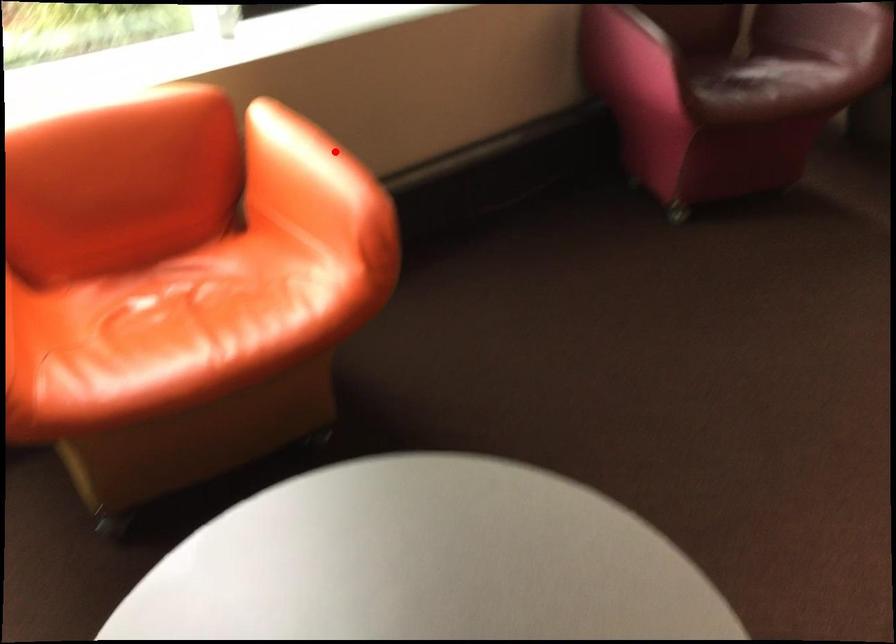
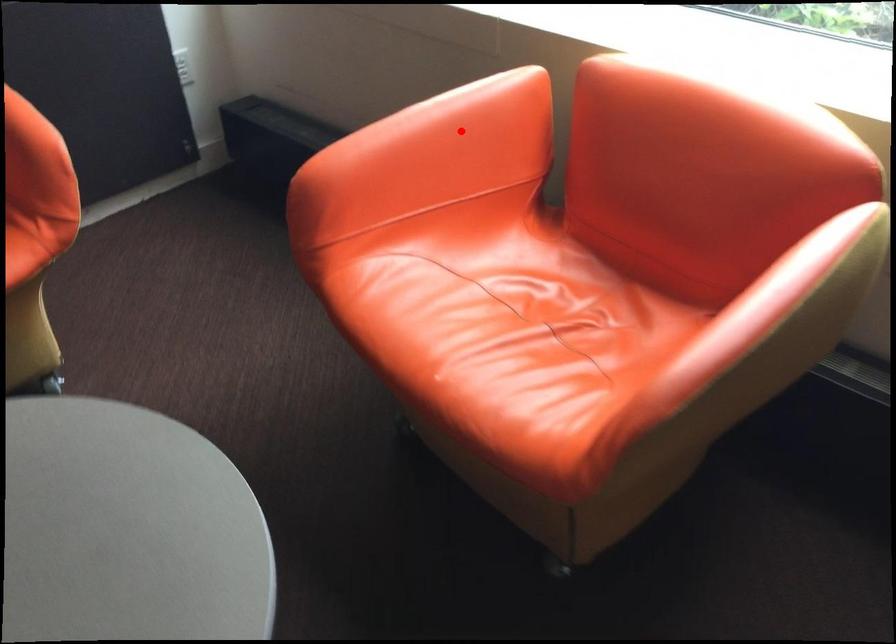
I am providing you with two images of the same scene from different viewpoints. A red point is marked on the first image and another point is marked on the second image. Is the red point in image1 aligned with the point shown in image2?

No